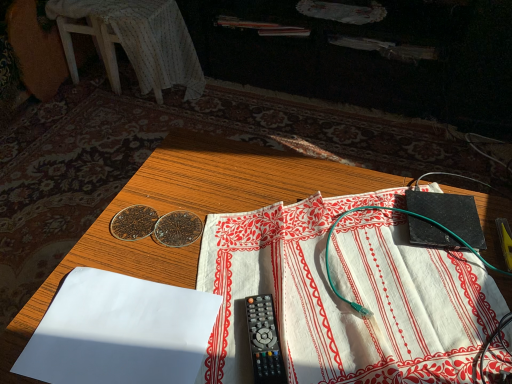
Question: From the image's perspective, does black plastic remote control at center appear lower than wooden table at center?

Choices:
 (A) yes
 (B) no

Answer: (B)

Question: Is the depth of black plastic remote control at center less than that of wooden table at center?

Choices:
 (A) no
 (B) yes

Answer: (A)

Question: Is black plastic remote control at center far from wooden table at center?

Choices:
 (A) no
 (B) yes

Answer: (A)

Question: Can you confirm if black plastic remote control at center is bigger than wooden table at center?

Choices:
 (A) no
 (B) yes

Answer: (A)

Question: From a real-world perspective, does black plastic remote control at center stand above wooden table at center?

Choices:
 (A) no
 (B) yes

Answer: (B)

Question: Is wooden table at center at the back of black plastic remote control at center?

Choices:
 (A) no
 (B) yes

Answer: (A)

Question: Considering the relative sizes of white paper at lower left, which appears as the 1th sheet when viewed from the left, and black plastic remote control at center in the image provided, is white paper at lower left, which appears as the 1th sheet when viewed from the left, bigger than black plastic remote control at center?

Choices:
 (A) no
 (B) yes

Answer: (B)

Question: Does white paper at lower left, the 2th sheet from the right, have a lesser width compared to black plastic remote control at center?

Choices:
 (A) yes
 (B) no

Answer: (B)

Question: Is white paper at lower left, which appears as the 1th sheet when viewed from the left, closer to camera compared to black plastic remote control at center?

Choices:
 (A) yes
 (B) no

Answer: (A)

Question: From a real-world perspective, does white paper at lower left, the 2th sheet from the right, sit lower than black plastic remote control at center?

Choices:
 (A) yes
 (B) no

Answer: (A)

Question: Can you see white paper at lower left, the 2th sheet from the right, touching black plastic remote control at center?

Choices:
 (A) yes
 (B) no

Answer: (B)

Question: Is white paper at lower left, which appears as the 1th sheet when viewed from the left, positioned with its back to black plastic remote control at center?

Choices:
 (A) no
 (B) yes

Answer: (B)

Question: Is wooden table at center at the left side of white cloth at center, acting as the 1th sheet starting from the right?

Choices:
 (A) yes
 (B) no

Answer: (A)